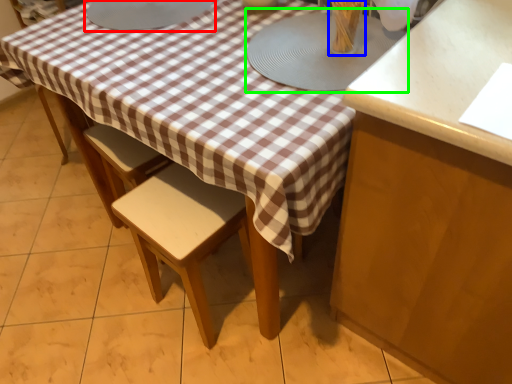
Question: Which is nearer to the round table (highlighted by a red box)? tableware (highlighted by a blue box) or round table (highlighted by a green box).

Choices:
 (A) tableware
 (B) round table

Answer: (B)